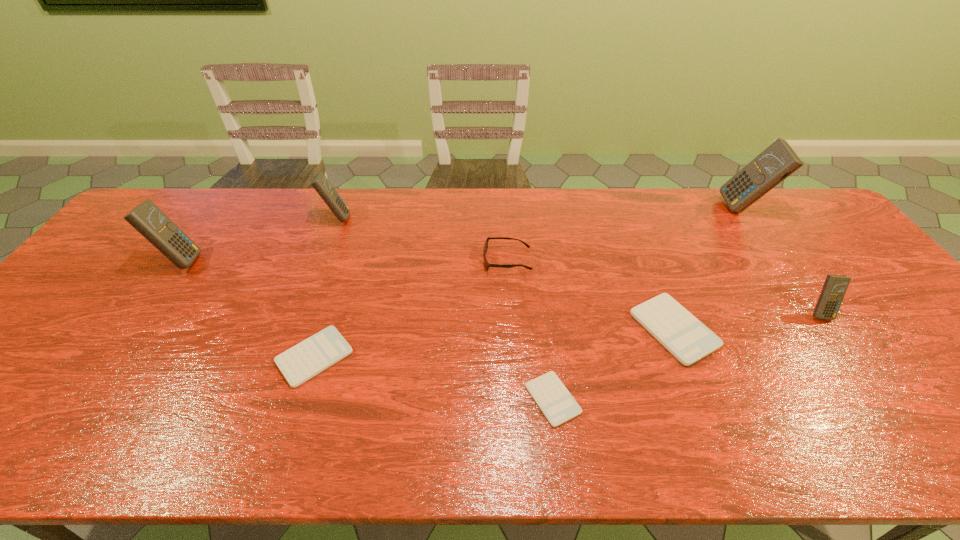
The width and height of the screenshot is (960, 540). In the image, there is a desktop. Find the location of `free space at the far edge`. free space at the far edge is located at coordinates (220, 207).

Image resolution: width=960 pixels, height=540 pixels. Identify the location of vacant region at the near edge of the desktop. (328, 450).

Locate an element on the screen. The height and width of the screenshot is (540, 960). vacant space at the left edge is located at coordinates (122, 243).

The width and height of the screenshot is (960, 540). In order to click on vacant space at the right edge of the desktop in this screenshot , I will do `click(855, 315)`.

You are a GUI agent. You are given a task and a screenshot of the screen. Output one action in this format:
    pyautogui.click(x=<x>, y=<y>)
    Task: Click on the free space between the sunglasses and the smallest white calculator
    This screenshot has height=540, width=960.
    Given the screenshot: What is the action you would take?
    click(530, 329)

At what (x,y) coordinates should I click in order to perform the action: click on free space between the sunglasses and the sixth tallest object. Please return your answer as a coordinate pair (x, y). Image resolution: width=960 pixels, height=540 pixels. Looking at the image, I should click on (590, 294).

The image size is (960, 540). I want to click on free space between the sixth shortest object and the second smallest white calculator, so click(x=325, y=287).

The width and height of the screenshot is (960, 540). Identify the location of vacant point located between the third farthest blue calculator and the second biggest white calculator. (248, 309).

The height and width of the screenshot is (540, 960). In order to click on empty space that is in between the second tallest object and the third tallest object in this screenshot , I will do `click(259, 239)`.

Locate an element on the screen. vacant space that's between the fourth shortest object and the biggest blue calculator is located at coordinates (625, 234).